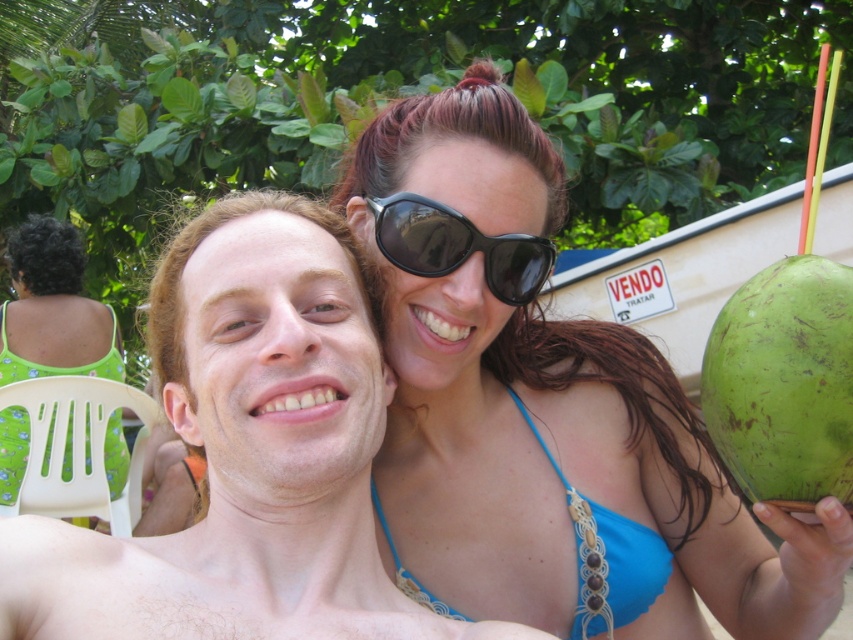
Is matte skin at center bigger than green rough coconut at right?

Yes, matte skin at center is bigger than green rough coconut at right.

The width and height of the screenshot is (853, 640). Identify the location of matte skin at center. (247, 452).

Does matte skin at center have a greater width compared to green floral dress at upper left?

No, matte skin at center is not wider than green floral dress at upper left.

The image size is (853, 640). Find the location of `matte skin at center`. matte skin at center is located at coordinates (247, 452).

Image resolution: width=853 pixels, height=640 pixels. What do you see at coordinates (544, 410) in the screenshot?
I see `blue bikini top at center` at bounding box center [544, 410].

From the picture: Who is more forward, (665, 364) or (407, 244)?

Point (407, 244)

Image resolution: width=853 pixels, height=640 pixels. Identify the location of blue bikini top at center. (544, 410).